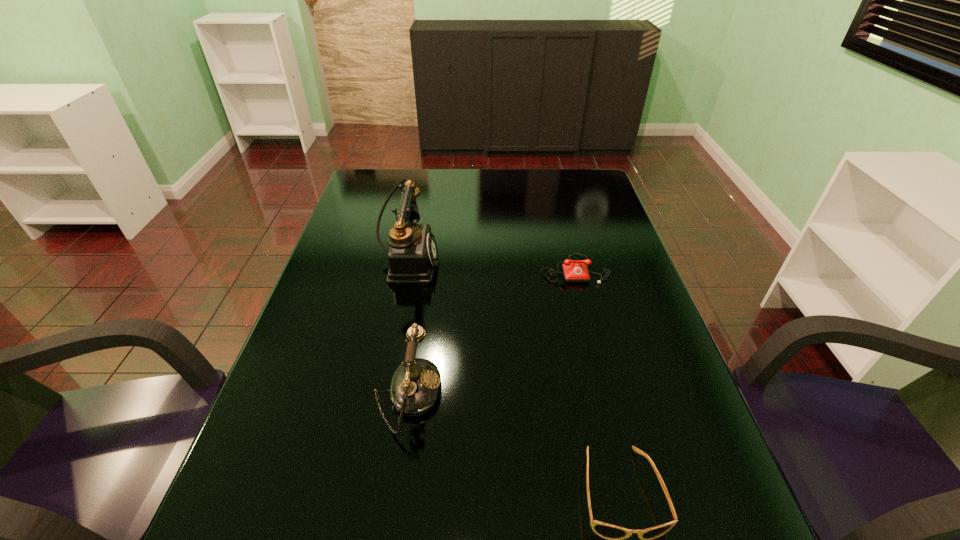
Identify the location of the tallest telephone. This screenshot has height=540, width=960. click(x=412, y=255).

This screenshot has height=540, width=960. I want to click on the third shortest object, so click(415, 387).

This screenshot has height=540, width=960. I want to click on the second shortest telephone, so click(415, 387).

I want to click on the rightmost telephone, so click(x=573, y=272).

Identify the location of vacant space located 0.400m on the front of the tallest telephone at the rotary dial. (580, 263).

Locate an element on the screen. The image size is (960, 540). free region located on the dial of the second tallest object is located at coordinates (521, 395).

Identify the location of free space located 0.390m on the dial of the rightmost telephone. Image resolution: width=960 pixels, height=540 pixels. (610, 414).

Locate an element on the screen. This screenshot has width=960, height=540. object that is at the left edge is located at coordinates (412, 255).

Locate an element on the screen. This screenshot has height=540, width=960. object that is at the right edge is located at coordinates (573, 272).

Locate an element on the screen. vacant space at the far edge of the desktop is located at coordinates (438, 191).